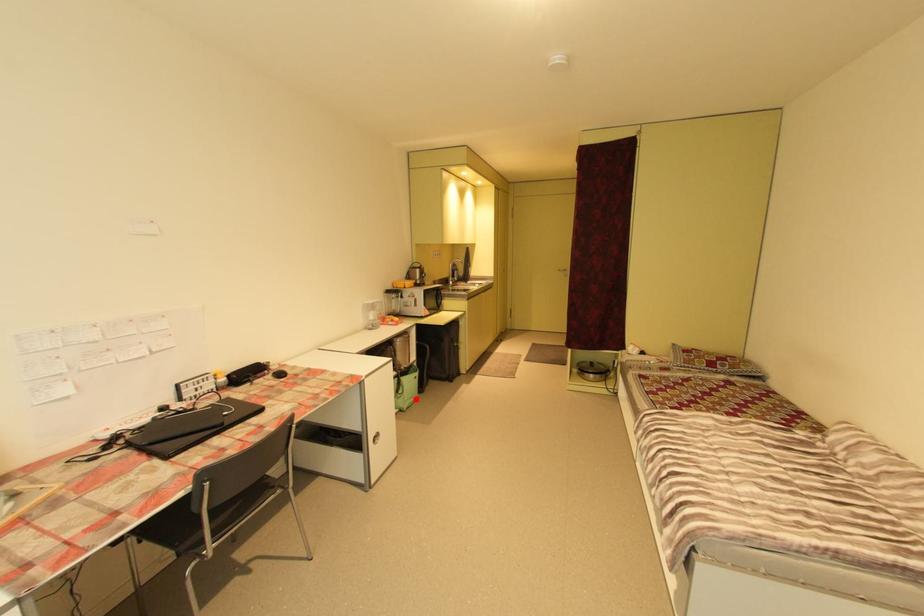
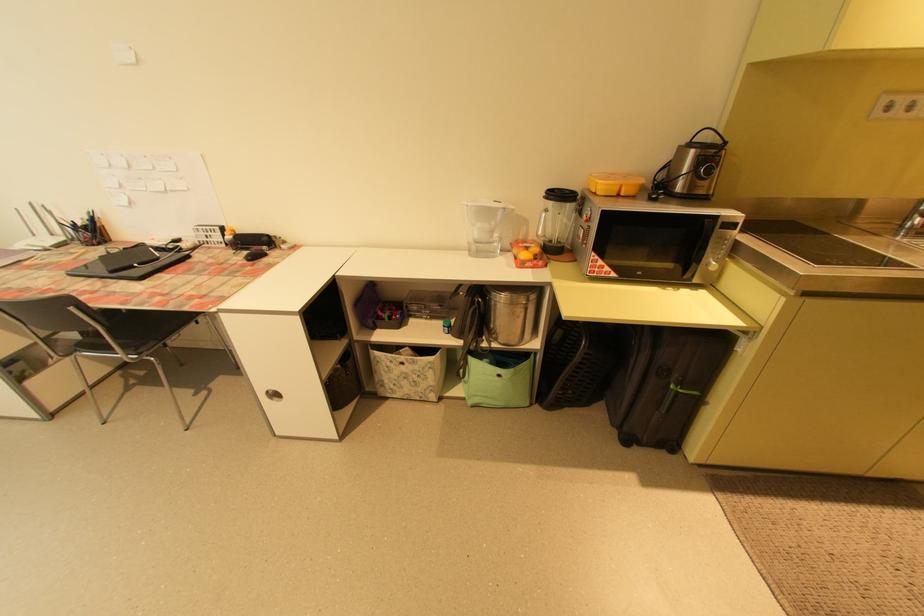
Question: I am providing you with two images of the same scene from different viewpoints. Given a red point in image1, look at the same physical point in image2. Is it:

Choices:
 (A) Closer to the viewpoint
 (B) Farther from the viewpoint

Answer: (B)